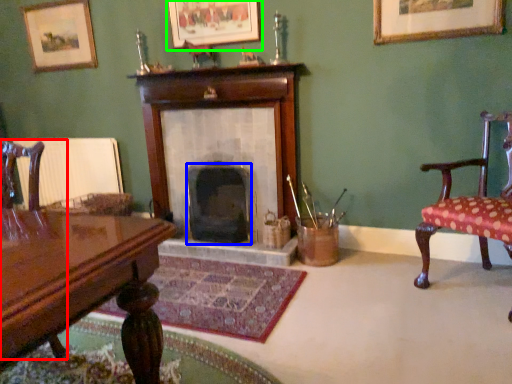
Question: Estimate the real-world distances between objects in this image. Which object is closer to chair (highlighted by a red box), fireplace (highlighted by a blue box) or picture frame (highlighted by a green box)?

Choices:
 (A) fireplace
 (B) picture frame

Answer: (A)